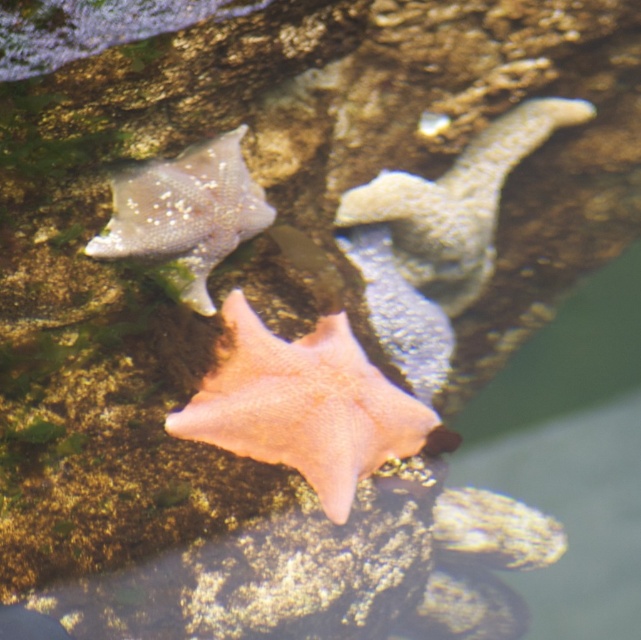
Question: Does pink matte starfish at center have a larger size compared to smooth gray starfish at center?

Choices:
 (A) no
 (B) yes

Answer: (A)

Question: Which object appears farthest from the camera in this image?

Choices:
 (A) smooth gray starfish at center
 (B) smooth gray starfish at upper left

Answer: (A)

Question: Among these points, which one is nearest to the camera?

Choices:
 (A) (488, 262)
 (B) (260, 436)
 (C) (160, 234)

Answer: (C)

Question: Which point is closer to the camera taking this photo?

Choices:
 (A) (444, 284)
 (B) (388, 401)

Answer: (B)

Question: Observing the image, what is the correct spatial positioning of pink matte starfish at center in reference to smooth gray starfish at center?

Choices:
 (A) above
 (B) below

Answer: (B)

Question: Can you confirm if pink matte starfish at center is thinner than smooth gray starfish at upper left?

Choices:
 (A) no
 (B) yes

Answer: (A)